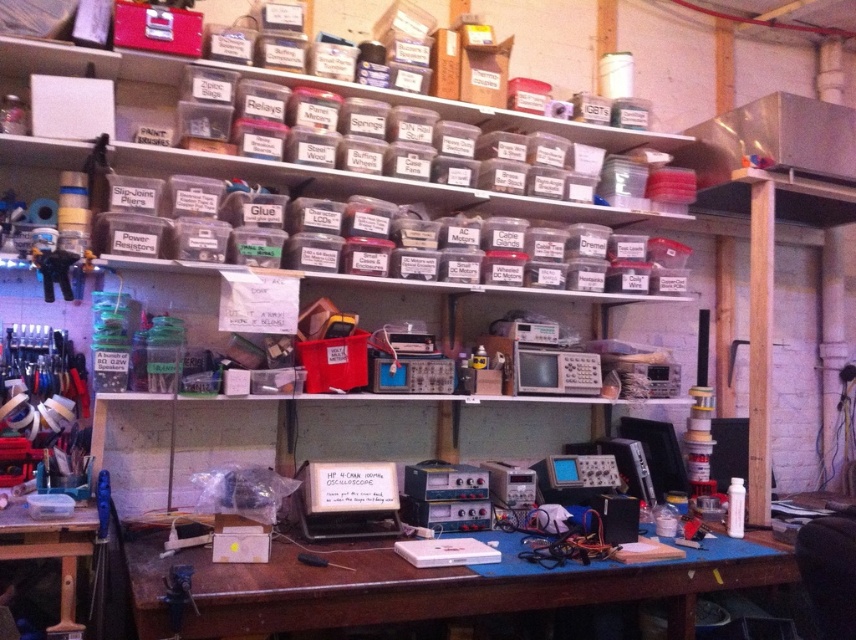
You are standing in the workshop and want to place a new component box on the blue plastic table at lower center. Where exactly should you place it?

The blue plastic table at lower center is located at coordinates 0.916 on the x axis and 0.500 on the y axis.

You are a technician who needs to reach the blue plastic table at lower center to retrieve a tool. Considering your arm length is 0.7 meters, can you reach the table without moving closer?

The blue plastic table at lower center is 1.71 meters away from the viewer. Since your arm length is only 0.7 meters, you cannot reach it without moving closer.

You are an electronics technician who needs to place a tall component on the table. Which table, the blue plastic table at lower center or the clear plastic table at lower left, is better suited for this task?

The blue plastic table at lower center is taller than the clear plastic table at lower left, so the blue plastic table at lower center is better suited for placing a tall component.